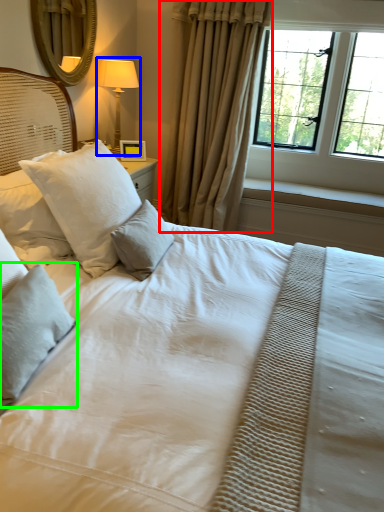
Question: Which is nearer to the curtain (highlighted by a red box)? bedside lamp (highlighted by a blue box) or pillow (highlighted by a green box).

Choices:
 (A) bedside lamp
 (B) pillow

Answer: (A)